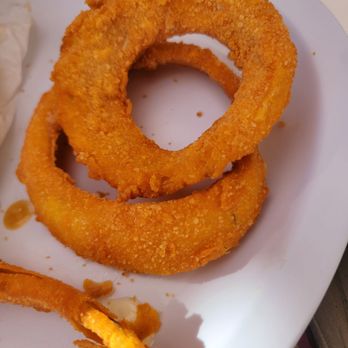
At what (x,y) coordinates should I click in order to perform the action: click on plate. Please return your answer as a coordinate pair (x, y). This screenshot has height=348, width=348. Looking at the image, I should click on (261, 298).